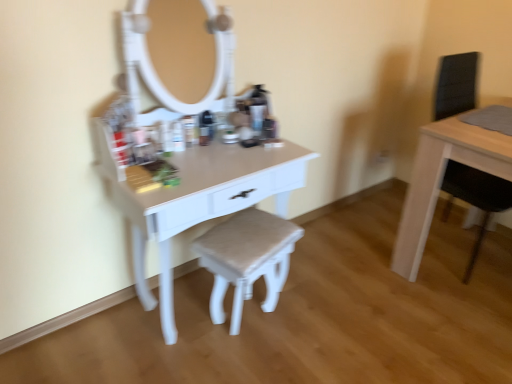
Find the location of a particular element. spots to the right of white glossy table at center, which ranks as the 2th table in right-to-left order is located at coordinates (342, 299).